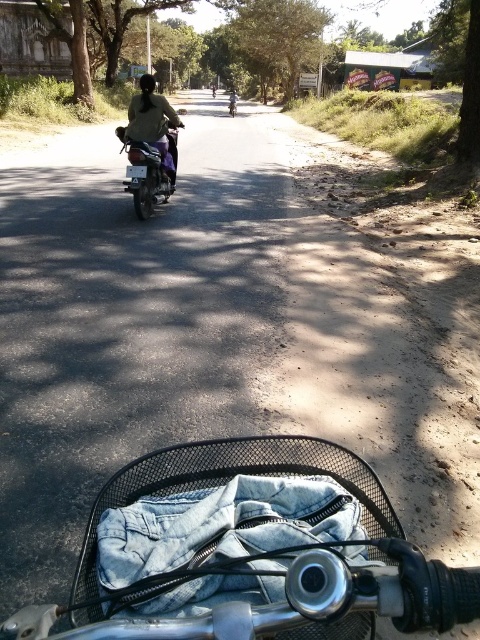
Does metallic blue motorcycle at center appear under light brown fabric shirt at center?

Indeed, metallic blue motorcycle at center is positioned under light brown fabric shirt at center.

Can you confirm if metallic blue motorcycle at center is wider than light brown fabric shirt at center?

Yes, metallic blue motorcycle at center is wider than light brown fabric shirt at center.

Identify the location of metallic blue motorcycle at center. The width and height of the screenshot is (480, 640). (148, 170).